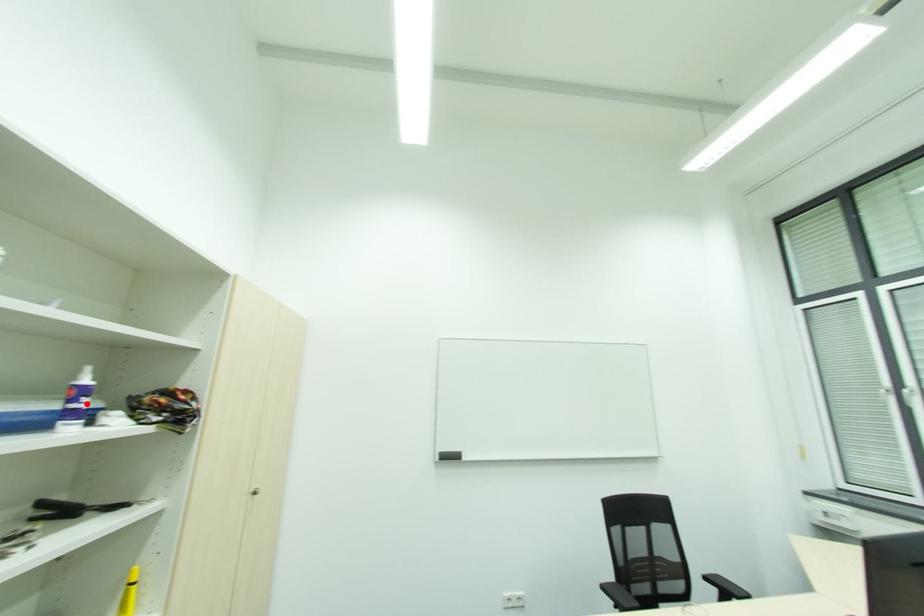
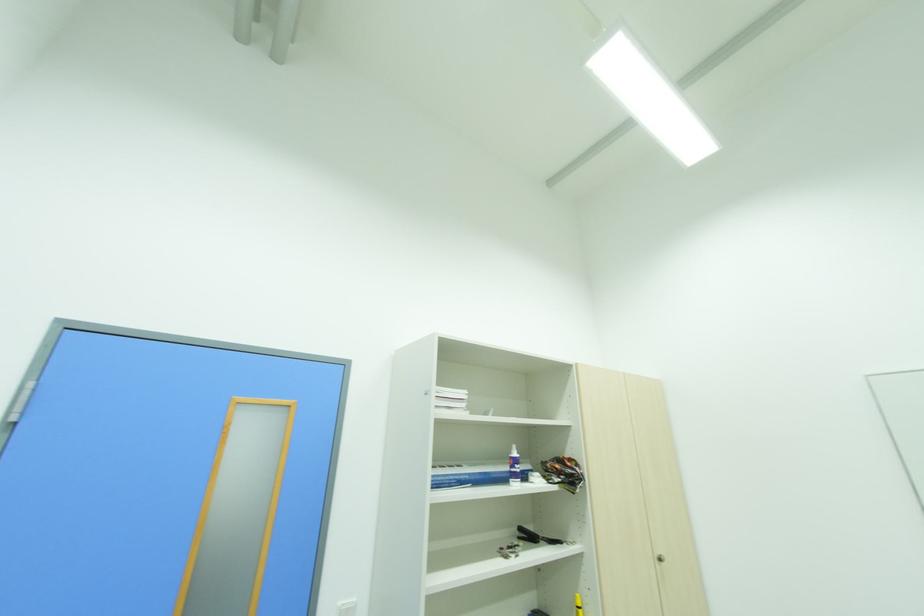
Question: A red point is marked in image1. In image2, is the corresponding 3D point closer to the camera or farther? Reply with the corresponding letter.

Choices:
 (A) The corresponding 3D point is closer.
 (B) The corresponding 3D point is farther.

Answer: (B)